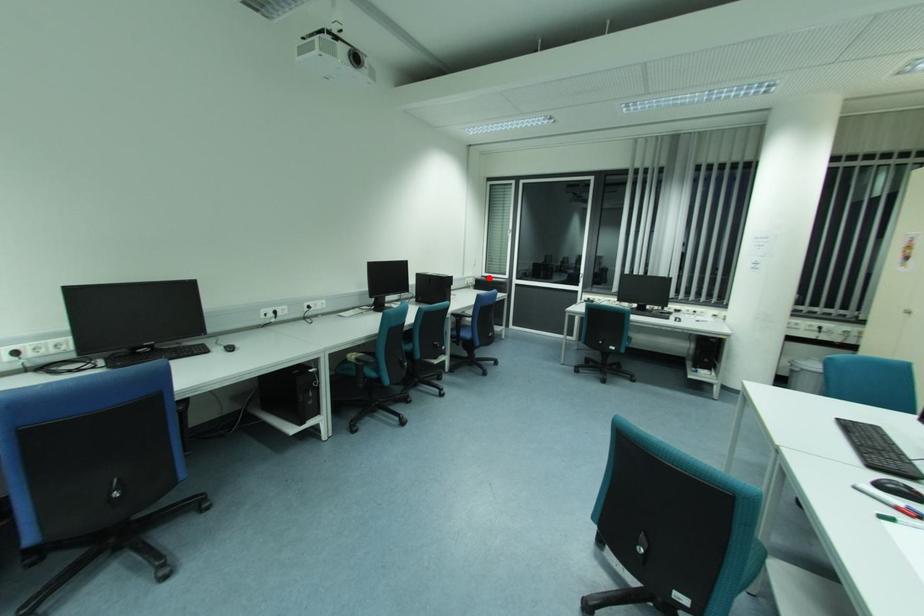
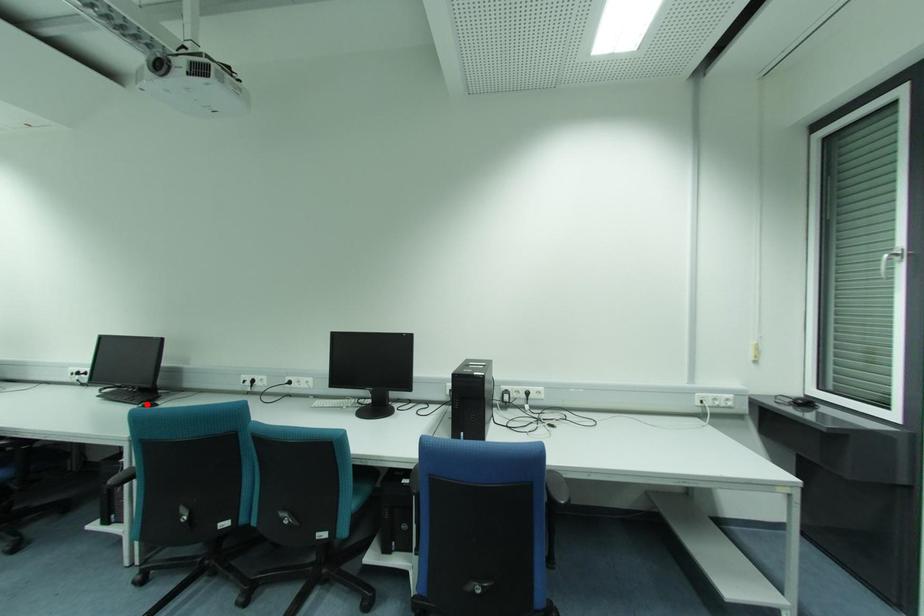
I am providing you with two images of the same scene from different viewpoints. A red point is marked on the first image and another point is marked on the second image. Are the points marked in image1 and image2 representing the same 3D position?

No